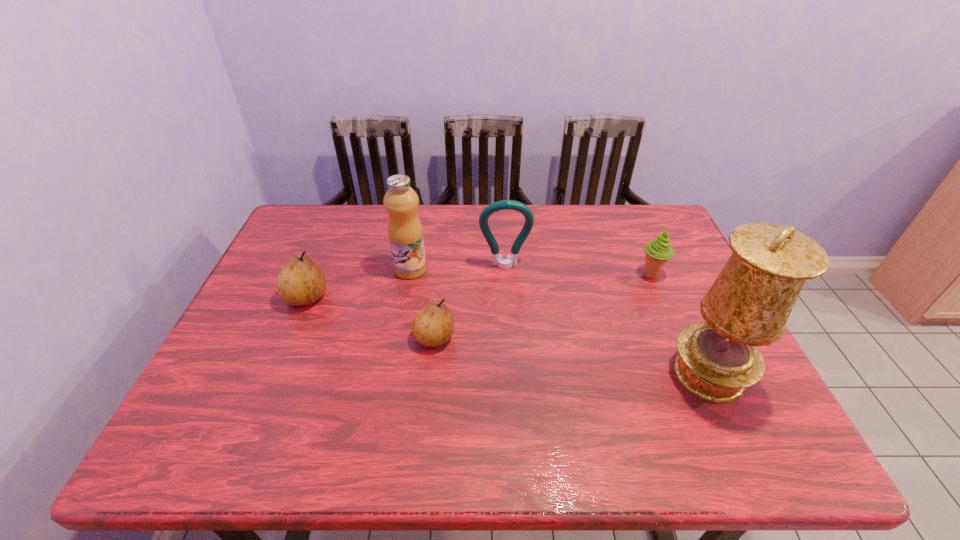
Given the evenly spaced pears in the image, where should an extra pear be added on the right to preserve the spacing? Please point to a vacant space. Please provide its 2D coordinates. Your answer should be formatted as a tuple, i.e. [(x, y)], where the tuple contains the x and y coordinates of a point satisfying the conditions above.

[(590, 387)]